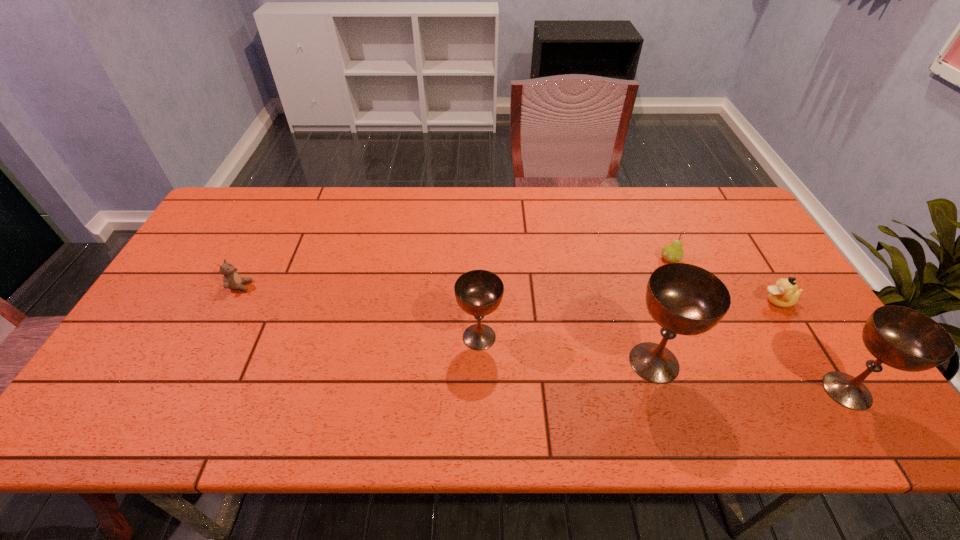
Where is `free area in between the fifth shortest object and the pear`? The height and width of the screenshot is (540, 960). free area in between the fifth shortest object and the pear is located at coordinates (758, 325).

At what (x,y) coordinates should I click in order to perform the action: click on free spot between the teddy bear and the second object from left to right. Please return your answer as a coordinate pair (x, y). Image resolution: width=960 pixels, height=540 pixels. Looking at the image, I should click on (360, 312).

You are a GUI agent. You are given a task and a screenshot of the screen. Output one action in this format:
    pyautogui.click(x=<x>, y=<y>)
    Task: Click on the fifth closest object relative to the rightmost chalice
    This screenshot has height=540, width=960.
    Given the screenshot: What is the action you would take?
    pyautogui.click(x=232, y=280)

What are the coordinates of `object that is the second nearest to the duckling` in the screenshot? It's located at [672, 253].

Select which chalice appears as the third closest to the duckling. Please provide its 2D coordinates. Your answer should be formatted as a tuple, i.e. [(x, y)], where the tuple contains the x and y coordinates of a point satisfying the conditions above.

[(479, 293)]

The width and height of the screenshot is (960, 540). Find the location of `chalice that is the second closest to the rightmost chalice`. chalice that is the second closest to the rightmost chalice is located at coordinates pyautogui.click(x=479, y=293).

At what (x,y) coordinates should I click in order to perform the action: click on free region that satisfies the following two spatial constraints: 1. on the front-facing side of the leftmost object; 2. on the left side of the rightmost chalice. Please return your answer as a coordinate pair (x, y). The width and height of the screenshot is (960, 540). Looking at the image, I should click on (187, 390).

Find the location of `free space that satisfies the following two spatial constraints: 1. on the front-facing side of the leftmost object; 2. on the left side of the second object from left to right`. free space that satisfies the following two spatial constraints: 1. on the front-facing side of the leftmost object; 2. on the left side of the second object from left to right is located at coordinates (214, 337).

The width and height of the screenshot is (960, 540). I want to click on free space that satisfies the following two spatial constraints: 1. on the face of the duckling; 2. on the front side of the shortest chalice, so click(x=800, y=337).

Where is `blank area in the image that satisfies the following two spatial constraints: 1. on the back side of the shortest chalice; 2. on the right side of the farthest object`? blank area in the image that satisfies the following two spatial constraints: 1. on the back side of the shortest chalice; 2. on the right side of the farthest object is located at coordinates (479, 259).